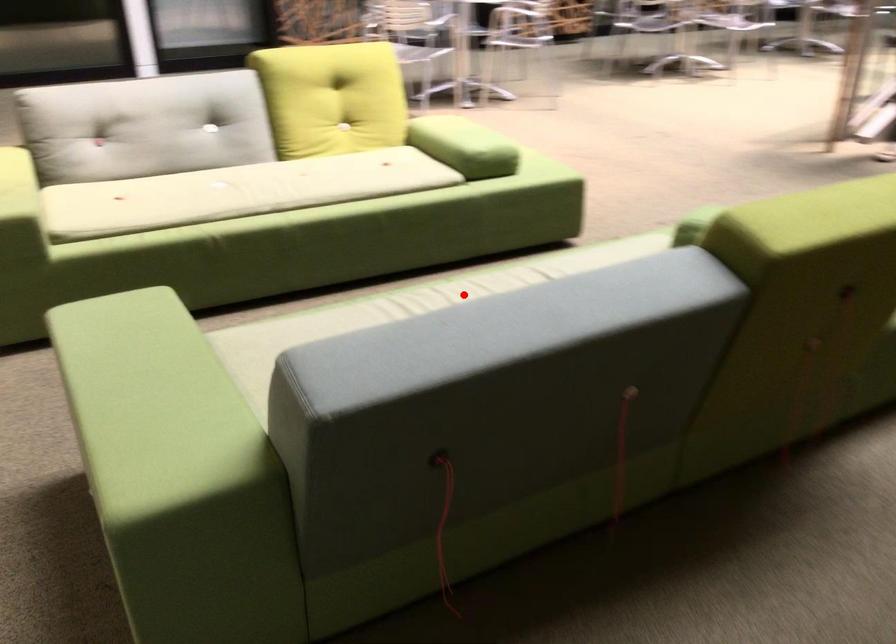
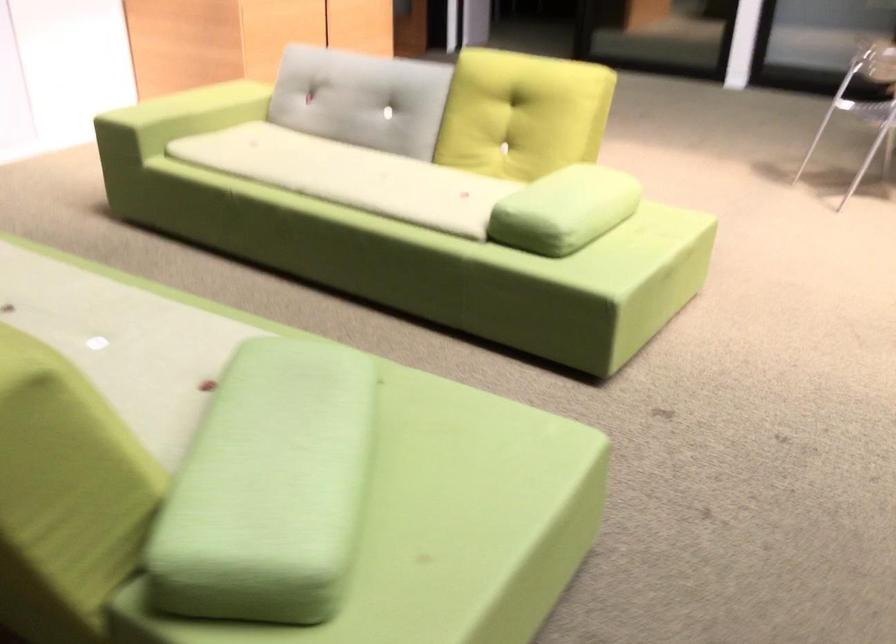
In the second image, find the point that corresponds to the highlighted location in the first image.

(66, 290)